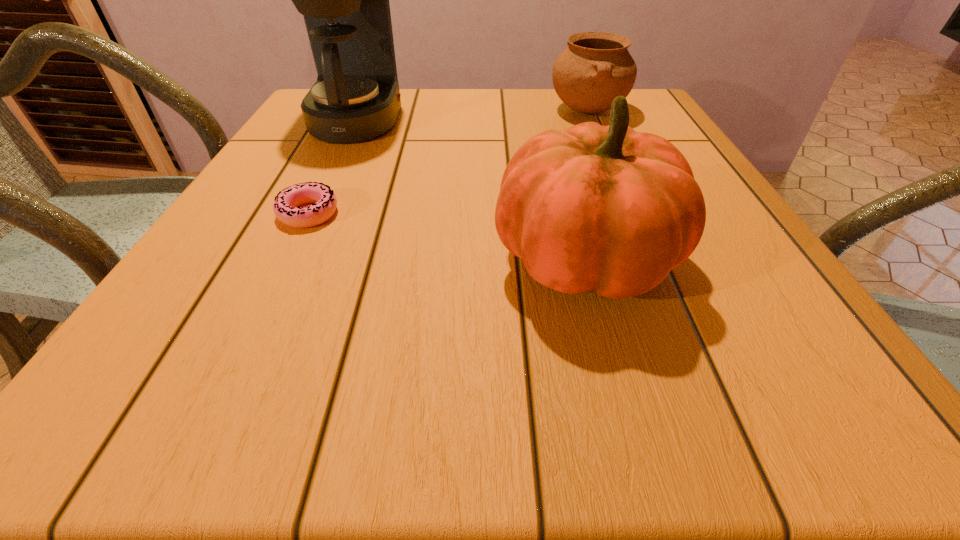
You are a GUI agent. You are given a task and a screenshot of the screen. Output one action in this format:
    pyautogui.click(x=<x>, y=<y>)
    Task: Click on the coffee maker that is at the left edge
    The height and width of the screenshot is (540, 960).
    Given the screenshot: What is the action you would take?
    pyautogui.click(x=354, y=97)

Where is `doughnut located at the left edge`? doughnut located at the left edge is located at coordinates (286, 203).

Where is `pumpkin that is at the right edge`? pumpkin that is at the right edge is located at coordinates (606, 209).

This screenshot has width=960, height=540. What are the coordinates of `pottery present at the right edge` in the screenshot? It's located at (596, 67).

At what (x,y) coordinates should I click in order to perform the action: click on object located at the far left corner. Please return your answer as a coordinate pair (x, y). The width and height of the screenshot is (960, 540). Looking at the image, I should click on (354, 97).

Locate an element on the screen. Image resolution: width=960 pixels, height=540 pixels. object that is at the far right corner is located at coordinates (596, 67).

Where is `vacant space at the far edge of the desktop`? vacant space at the far edge of the desktop is located at coordinates (471, 95).

This screenshot has width=960, height=540. What are the coordinates of `vacant space at the near edge` in the screenshot? It's located at (485, 401).

This screenshot has height=540, width=960. In the image, there is a desktop. Identify the location of vacant space at the left edge. (207, 285).

You are a GUI agent. You are given a task and a screenshot of the screen. Output one action in this format:
    pyautogui.click(x=<x>, y=<y>)
    Task: Click on the free space at the right edge
    
    Given the screenshot: What is the action you would take?
    pyautogui.click(x=721, y=244)